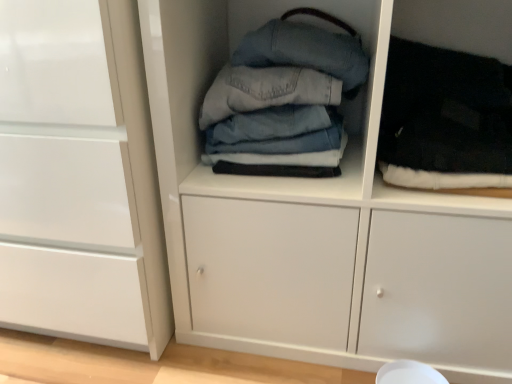
Question: Is denim fabric jeans at center, acting as the second clothing starting from the right, situated inside white glossy cabinet at left or outside?

Choices:
 (A) inside
 (B) outside

Answer: (B)

Question: Considering the positions of denim fabric jeans at center, acting as the second clothing starting from the right, and white glossy cabinet at left in the image, is denim fabric jeans at center, acting as the second clothing starting from the right, wider or thinner than white glossy cabinet at left?

Choices:
 (A) wide
 (B) thin

Answer: (B)

Question: Which of these objects is positioned farthest from the denim fabric jeans at center, acting as the second clothing starting from the right?

Choices:
 (A) denim fabric stack at center
 (B) white glossy cabinet at left
 (C) black fuzzy socks at right, which is the 2th clothing in left-to-right order

Answer: (B)

Question: Based on their relative distances, which object is nearer to the white glossy cabinet at left?

Choices:
 (A) denim fabric jeans at center, acting as the second clothing starting from the right
 (B) denim fabric stack at center
 (C) black fuzzy socks at right, the first clothing in the right-to-left sequence

Answer: (B)